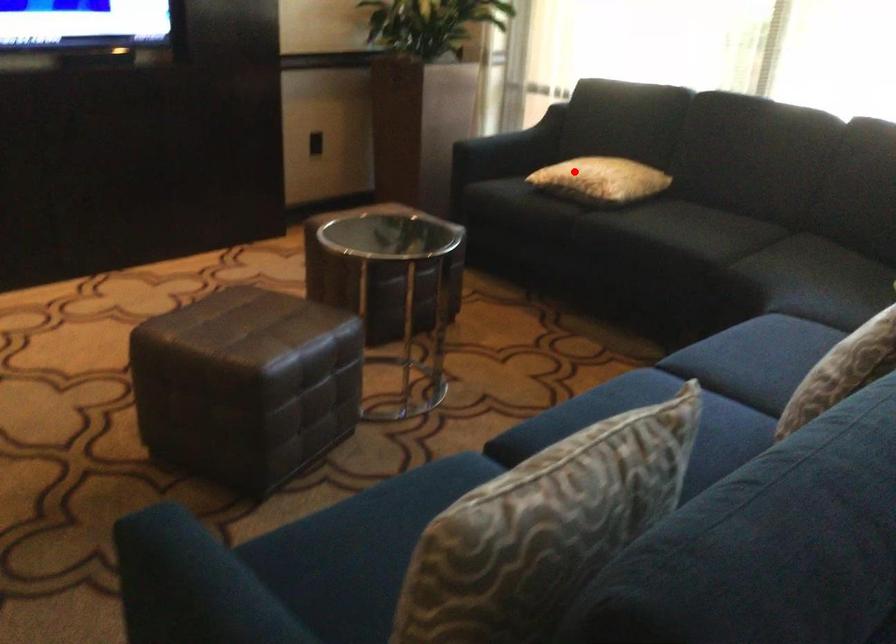
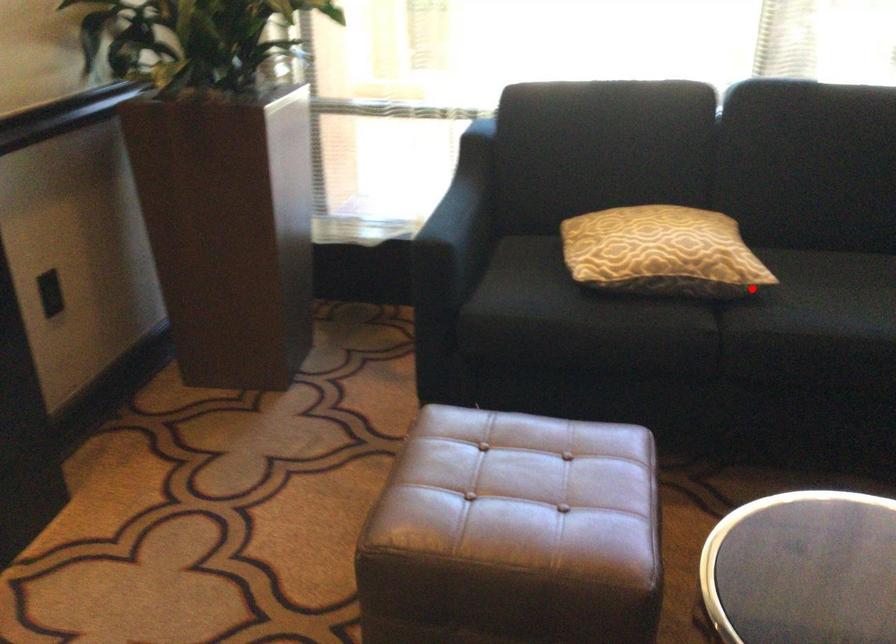
I am providing you with two images of the same scene from different viewpoints. A red point is marked on the first image and another point is marked on the second image. Are the points marked in image1 and image2 representing the same 3D position?

No